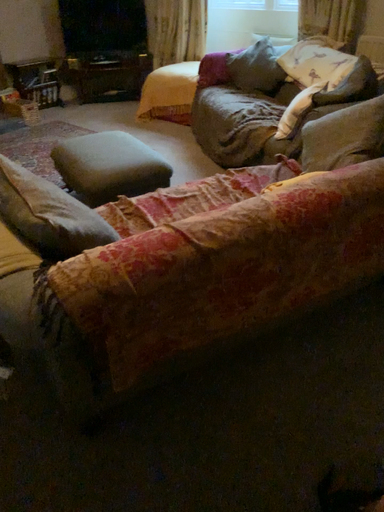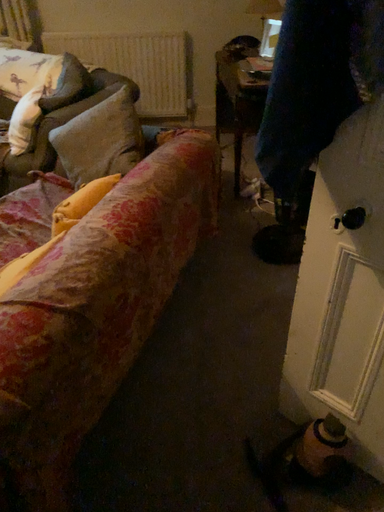
Question: How did the camera likely rotate when shooting the video?

Choices:
 (A) rotated upward
 (B) rotated downward

Answer: (A)